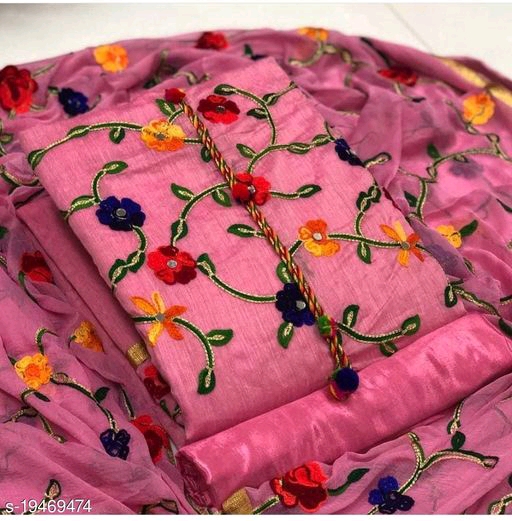
Locate an element on the screen. Image resolution: width=512 pixels, height=521 pixels. white surface is located at coordinates (475, 24).